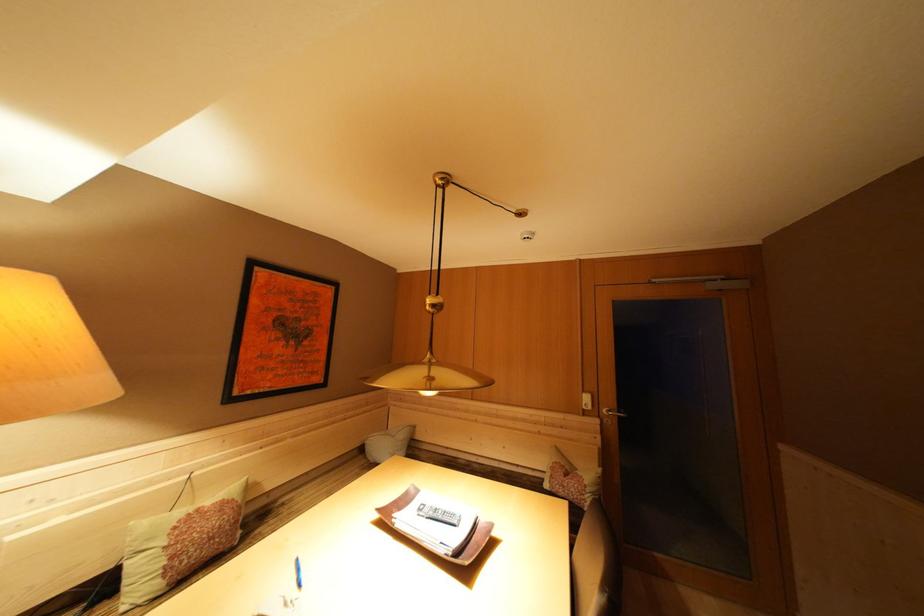
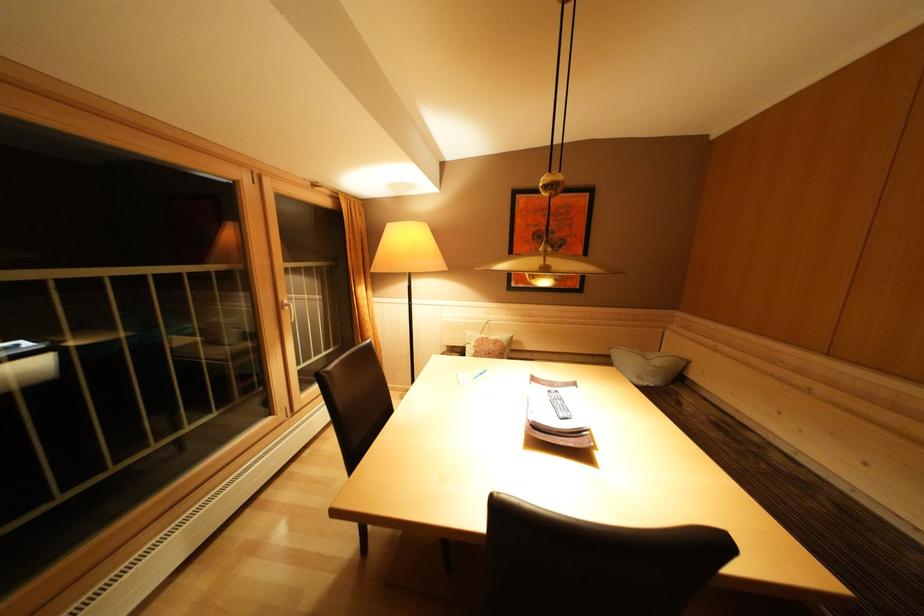
Question: The camera is either moving clockwise (left) or counter-clockwise (right) around the object. The first image is from the beginning of the video and the second image is from the end. Is the camera moving left or right when shooting the video?

Choices:
 (A) Left
 (B) Right

Answer: (B)